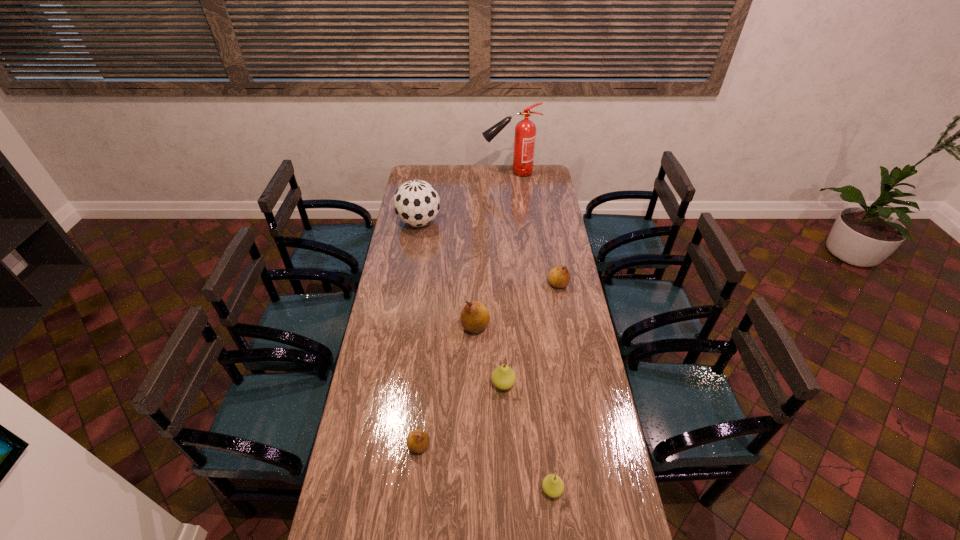
Locate an element on the screen. the farthest object is located at coordinates (525, 131).

Image resolution: width=960 pixels, height=540 pixels. In order to click on red fire extinguisher in this screenshot , I will do `click(525, 131)`.

Find the location of a particular element. The image size is (960, 540). the second farthest object is located at coordinates (416, 203).

This screenshot has height=540, width=960. Find the location of `soccer ball`. soccer ball is located at coordinates (416, 203).

I want to click on the second pear from left to right, so click(475, 317).

At what (x,y) coordinates should I click in order to perform the action: click on the second farthest pear. Please return your answer as a coordinate pair (x, y). The image size is (960, 540). Looking at the image, I should click on (475, 317).

Identify the location of the second biggest brown pear. This screenshot has width=960, height=540. coord(559,277).

Image resolution: width=960 pixels, height=540 pixels. Find the location of `the farthest brown pear`. the farthest brown pear is located at coordinates (559, 277).

Find the location of a particular element. This screenshot has width=960, height=540. the farther green pear is located at coordinates (503, 377).

I want to click on the third pear from right to left, so click(x=503, y=377).